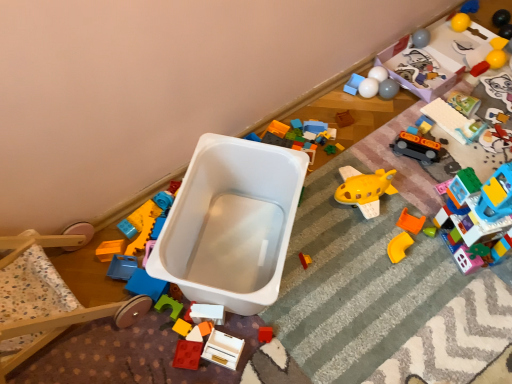
This screenshot has height=384, width=512. I want to click on vacant space in between white plastic baby carriage at center and wooden toy box at center, the thirteenth toy positioned from the right, so click(209, 337).